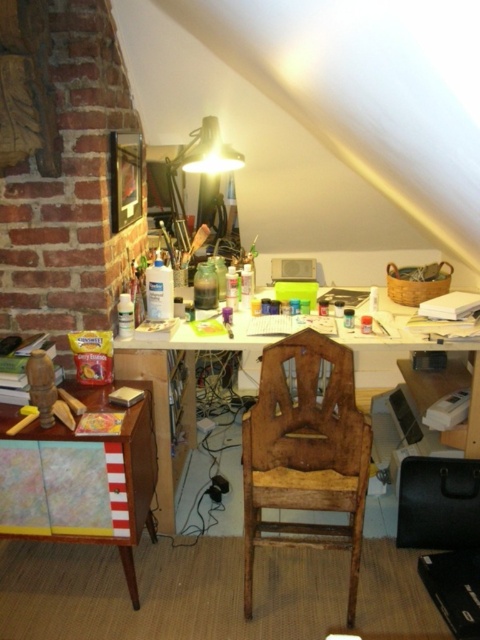
You are organizing a small meeting in the workspace shown. You need to seat two people comfortably. Given the wooden chair at center and the wooden desk at center, can both fit in the space if placed side by side?

The wooden chair at center is smaller than the wooden desk at center, so they can fit side by side as long as there is enough space in the workspace.